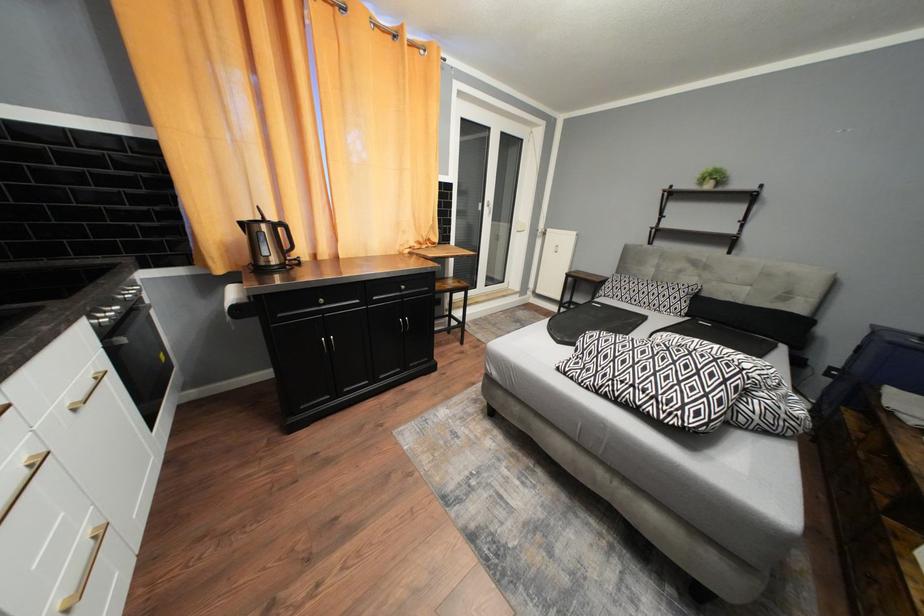
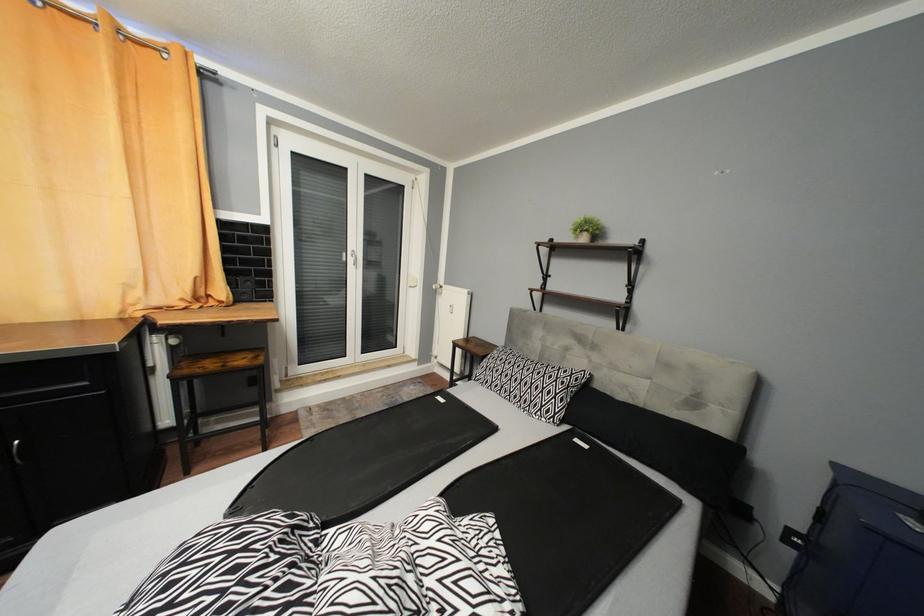
What movement of the cameraman would produce the second image?

The cameraman moved toward right, forward.